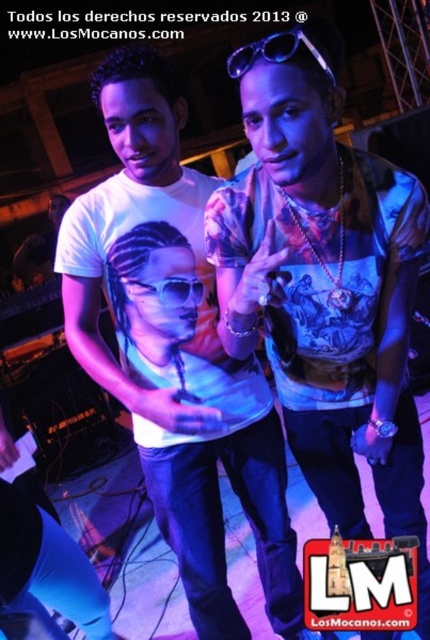
Question: Considering the real-world distances, which object is closest to the black plastic goggles at upper center?

Choices:
 (A) printed cotton shirt at center
 (B) matte white t-shirt at center

Answer: (A)

Question: Is printed cotton shirt at center wider than transparent plastic goggles at center?

Choices:
 (A) yes
 (B) no

Answer: (A)

Question: Which of the following is the closest to the observer?

Choices:
 (A) (245, 625)
 (B) (196, 289)

Answer: (B)

Question: Which of the following is the farthest from the observer?

Choices:
 (A) (187, 296)
 (B) (239, 60)
 (C) (387, 381)

Answer: (A)

Question: Is printed cotton shirt at center wider than matte white t-shirt at center?

Choices:
 (A) yes
 (B) no

Answer: (B)

Question: Can you confirm if matte white t-shirt at center is bigger than transparent plastic goggles at center?

Choices:
 (A) yes
 (B) no

Answer: (A)